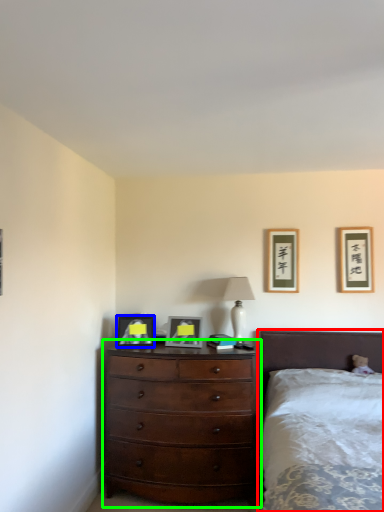
Question: Which is farther away from bed (highlighted by a red box)? picture frame (highlighted by a blue box) or chest of drawers (highlighted by a green box)?

Choices:
 (A) picture frame
 (B) chest of drawers

Answer: (A)